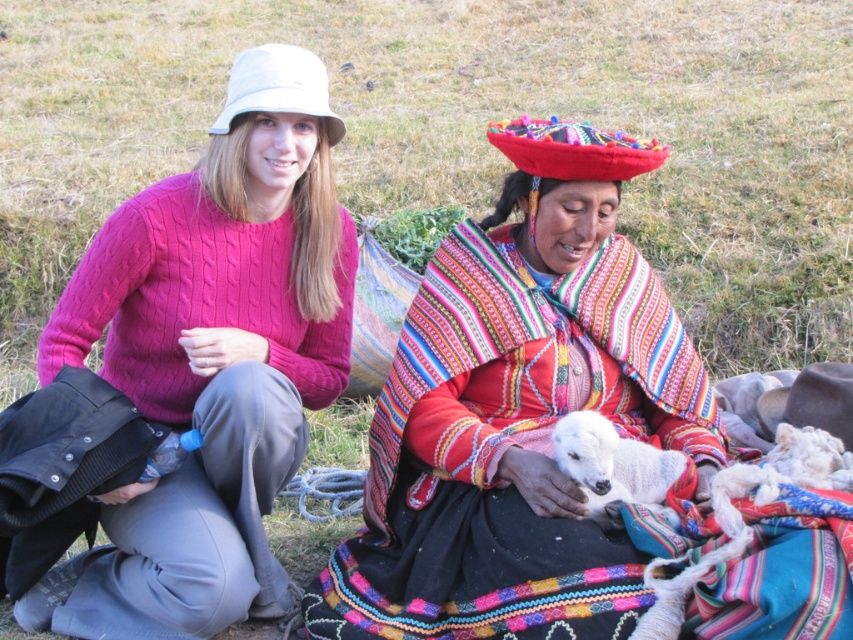
Measure the distance between multicolored woven shawl at center and camera.

They are 8.40 feet apart.

Does multicolored woven shawl at center appear on the left side of cable-knit sweater at left?

No, multicolored woven shawl at center is not to the left of cable-knit sweater at left.

This screenshot has width=853, height=640. What do you see at coordinates (518, 413) in the screenshot? I see `multicolored woven shawl at center` at bounding box center [518, 413].

The width and height of the screenshot is (853, 640). Find the location of `multicolored woven shawl at center`. multicolored woven shawl at center is located at coordinates (518, 413).

Does multicolored woven shawl at center have a larger size compared to white woolen lamb at center?

Indeed, multicolored woven shawl at center has a larger size compared to white woolen lamb at center.

Can you confirm if multicolored woven shawl at center is positioned to the right of white woolen lamb at center?

Incorrect, multicolored woven shawl at center is not on the right side of white woolen lamb at center.

Where is `multicolored woven shawl at center`? multicolored woven shawl at center is located at coordinates (518, 413).

You are a GUI agent. You are given a task and a screenshot of the screen. Output one action in this format:
    pyautogui.click(x=<x>, y=<y>)
    Task: Click on the multicolored woven shawl at center
    The height and width of the screenshot is (640, 853).
    Given the screenshot: What is the action you would take?
    pyautogui.click(x=518, y=413)

Who is more forward, (212,340) or (646,449)?

Point (646,449) is more forward.

Is cable-knit sweater at left closer to camera compared to white woolen lamb at center?

No, cable-knit sweater at left is behind white woolen lamb at center.

The image size is (853, 640). What do you see at coordinates (212, 358) in the screenshot?
I see `cable-knit sweater at left` at bounding box center [212, 358].

Identify the location of cable-knit sweater at left. Image resolution: width=853 pixels, height=640 pixels. (212, 358).